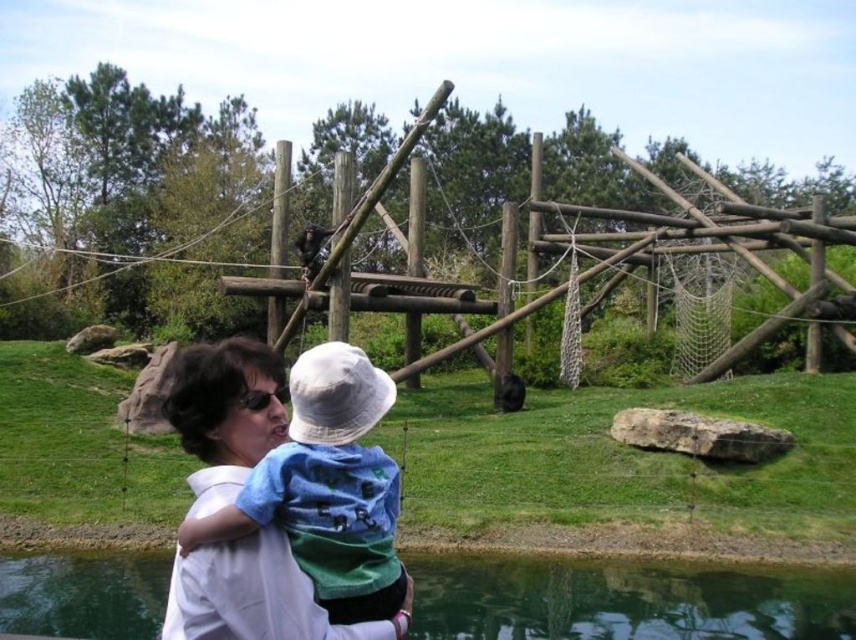
You are a zookeeper who needs to ensure safety for visitors. The clear water at lower center and the blue cotton shirt at center are both visible from the observation deck. Which object is bigger in size?

The clear water at lower center is larger in size than the blue cotton shirt at center, so the water is bigger.

You are standing at the point marked by the coordinates point (697,237) in the zoo scene. What is directly below you?

The point (697,237) is on wooden at upper center, so directly below it would be the wooden structure in the midground.

You are a zookeeper who needs to clean the area. You see the wooden at upper center and the blue cotton shirt at center. Which object is positioned higher from the ground?

The wooden at upper center is located above the blue cotton shirt at center, so it is positioned higher from the ground.